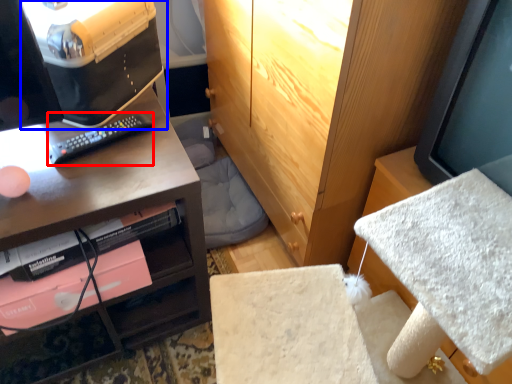
Question: Which object is further to the camera taking this photo, remote (highlighted by a red box) or desktop computer (highlighted by a blue box)?

Choices:
 (A) remote
 (B) desktop computer

Answer: (A)